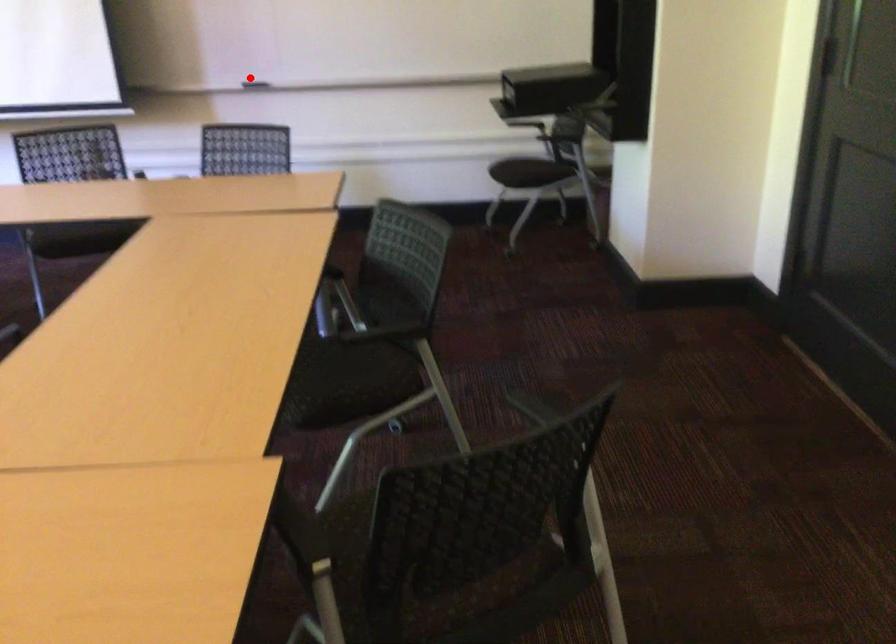
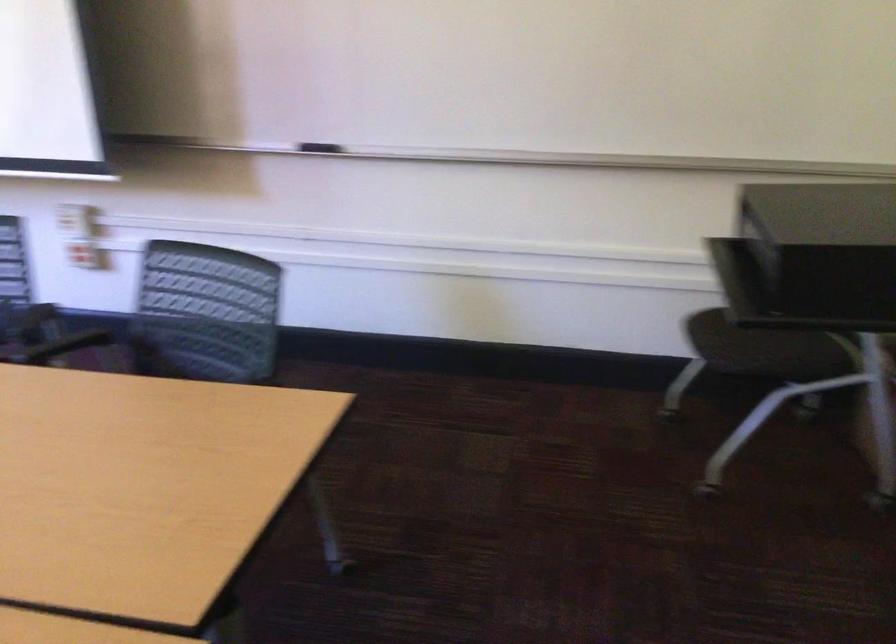
The point at the highlighted location is marked in the first image. Where is the corresponding point in the second image?

(319, 147)